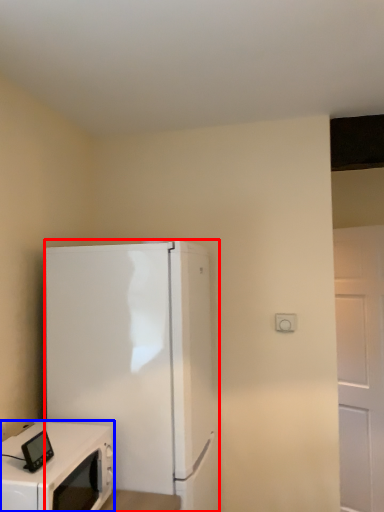
Question: Which point is further to the camera, refrigerator (highlighted by a red box) or home appliance (highlighted by a blue box)?

Choices:
 (A) refrigerator
 (B) home appliance

Answer: (A)